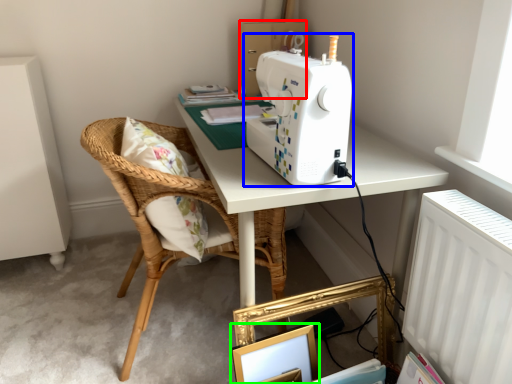
Question: Which object is the closest to the cardboard box (highlighted by a red box)? Choose among these: sewing machine (highlighted by a blue box) or picture frame (highlighted by a green box).

Choices:
 (A) sewing machine
 (B) picture frame

Answer: (A)